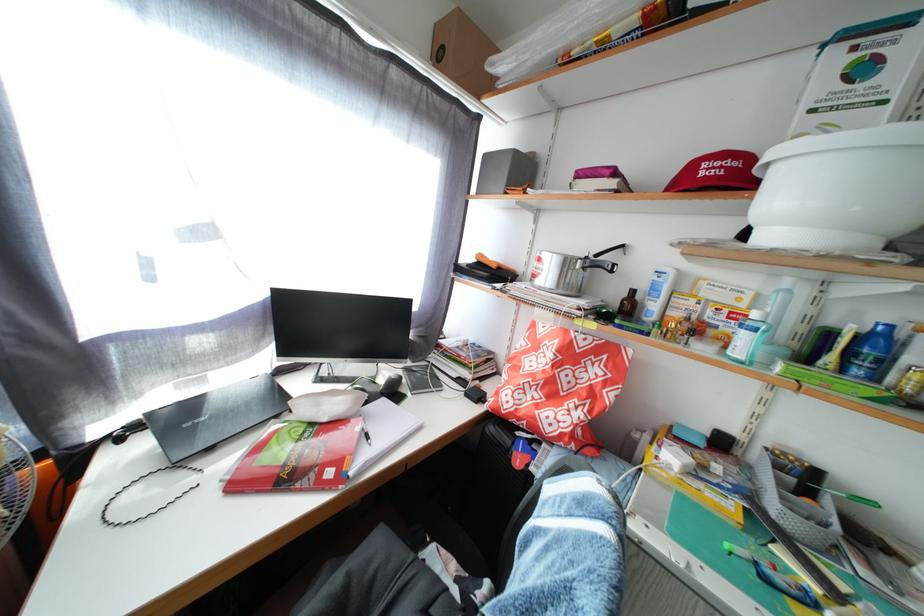
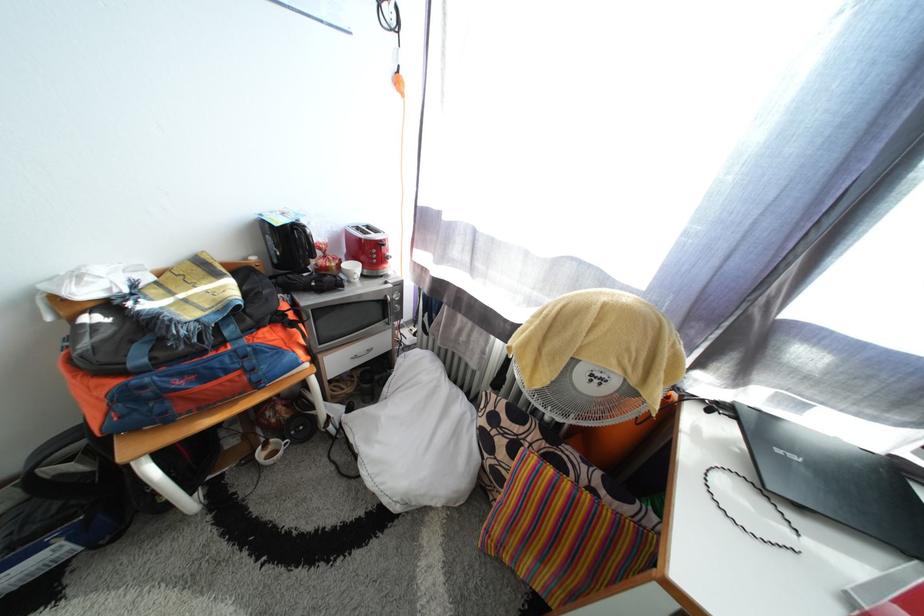
The first image is from the beginning of the video and the second image is from the end. How did the camera likely rotate when shooting the video?

The rotation direction of the camera is left-down.